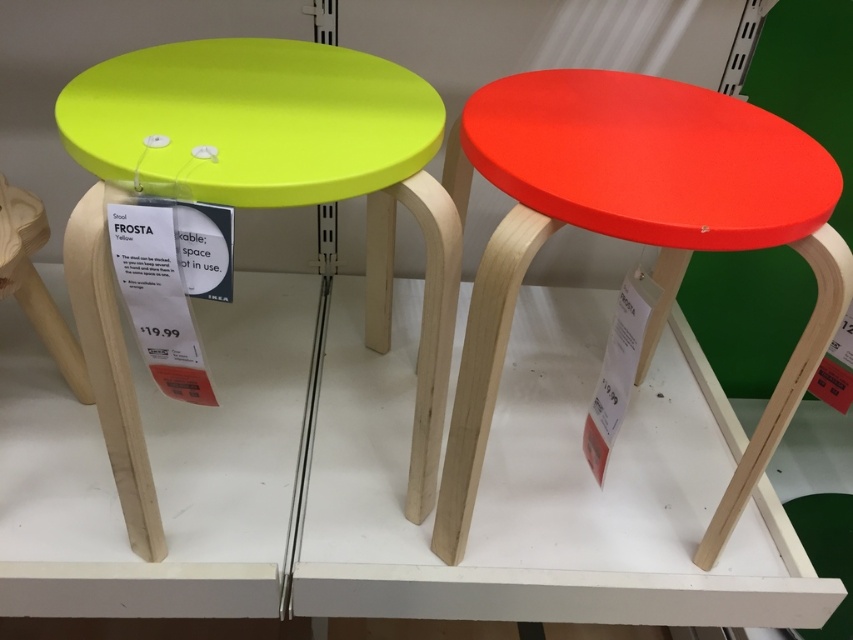
Is matte yellow stool at left below matte red stool at right?

Yes.

Who is more forward, (103, 150) or (483, 426)?

Point (103, 150) is more forward.

You are a GUI agent. You are given a task and a screenshot of the screen. Output one action in this format:
    pyautogui.click(x=<x>, y=<y>)
    Task: Click on the matte yellow stool at left
    
    Given the screenshot: What is the action you would take?
    pyautogui.click(x=254, y=200)